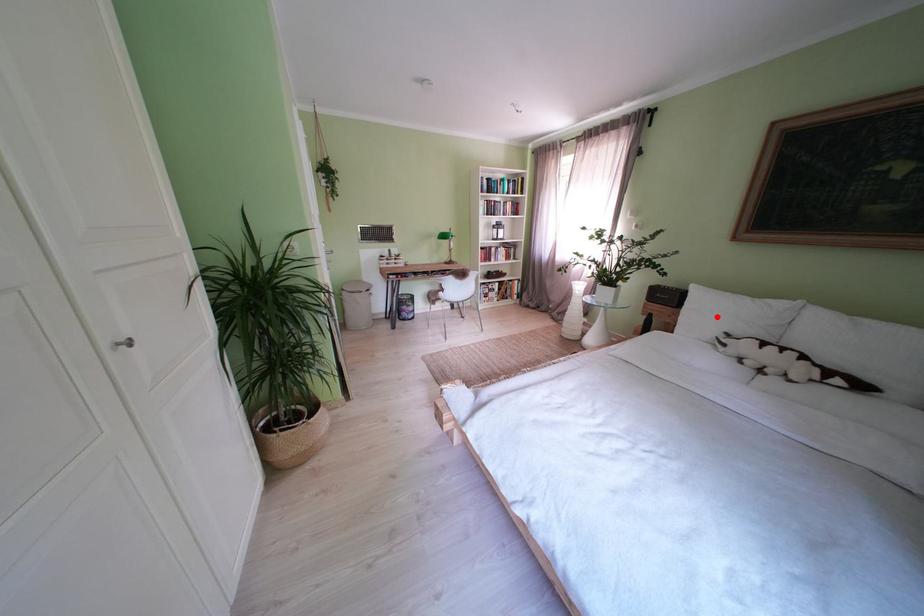
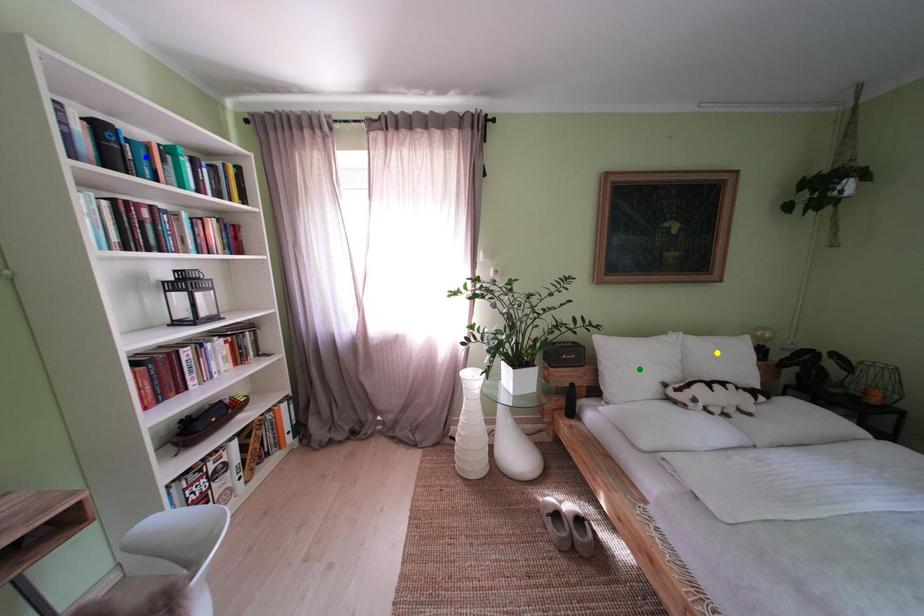
Question: I am providing you with two images of the same scene from different viewpoints. A red point is marked on the first image. You are given multiple points on the second image. Which point in image 2 is actually the same real-world point as the red point in image 1?

Choices:
 (A) yellow point
 (B) green point
 (C) blue point

Answer: (B)